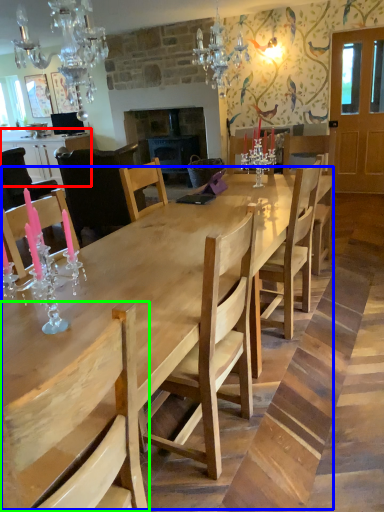
Question: Based on their relative distances, which object is farther from cabinetry (highlighted by a red box)? Choose from kitchen & dining room table (highlighted by a blue box) and chair (highlighted by a green box).

Choices:
 (A) kitchen & dining room table
 (B) chair

Answer: (B)